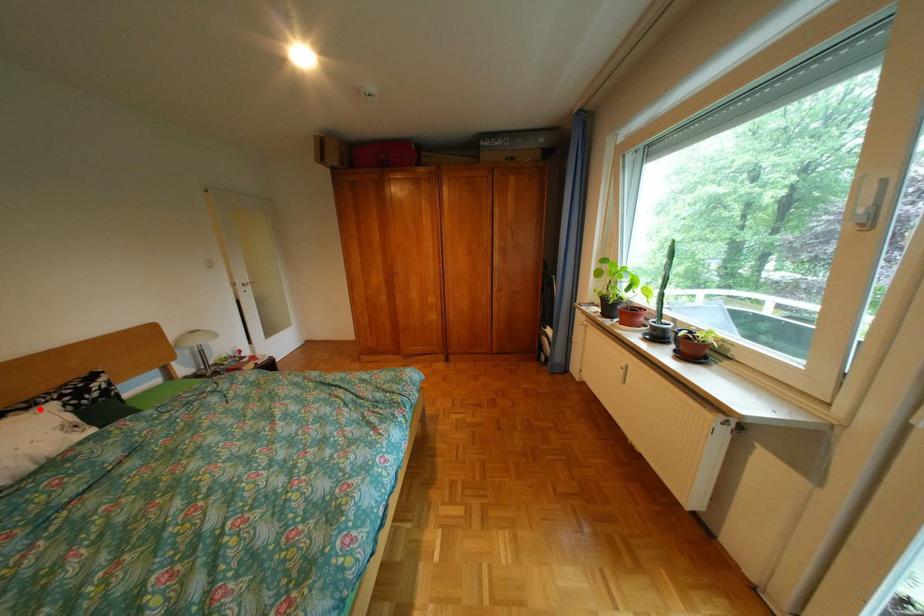
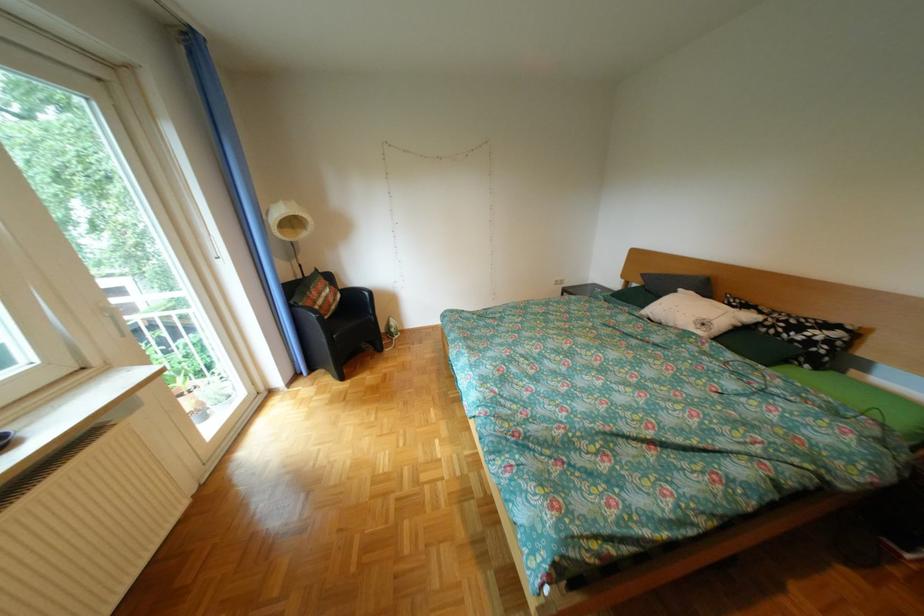
Question: A red point is marked in image1. In image2, is the corresponding 3D point closer to the camera or farther? Reply with the corresponding letter.

Choices:
 (A) The corresponding 3D point is closer.
 (B) The corresponding 3D point is farther.

Answer: (A)